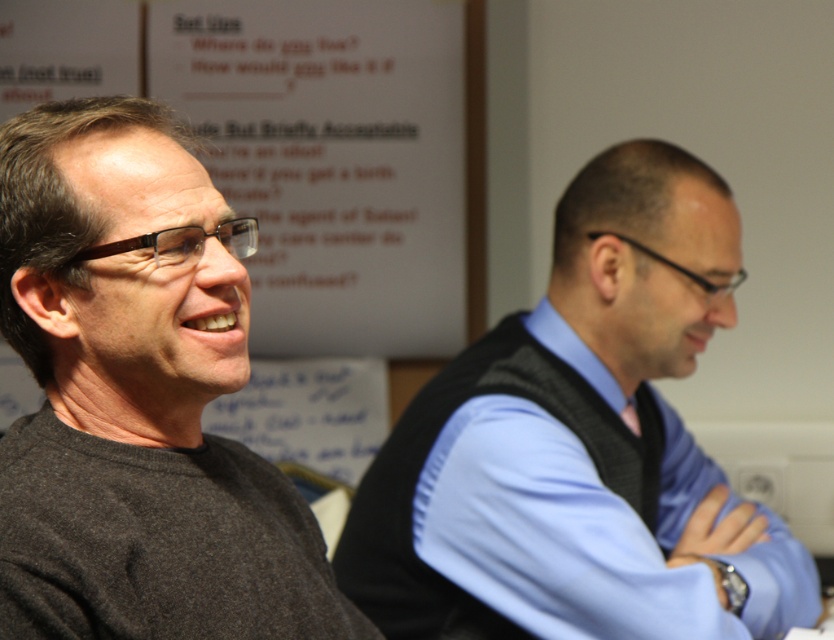
Question: Can you confirm if light blue shirt at right is positioned to the left of dark gray sweater at left?

Choices:
 (A) no
 (B) yes

Answer: (A)

Question: Which point is closer to the camera taking this photo?

Choices:
 (A) coord(149,628)
 (B) coord(641,141)

Answer: (A)

Question: Which of the following is the closest to the observer?

Choices:
 (A) (9, 596)
 (B) (495, 460)

Answer: (A)

Question: Does light blue shirt at right appear on the left side of dark gray sweater at left?

Choices:
 (A) yes
 (B) no

Answer: (B)

Question: Which object appears closest to the camera in this image?

Choices:
 (A) light blue shirt at right
 (B) dark gray sweater at left

Answer: (B)

Question: In this image, where is light blue shirt at right located relative to dark gray sweater at left?

Choices:
 (A) left
 (B) right

Answer: (B)